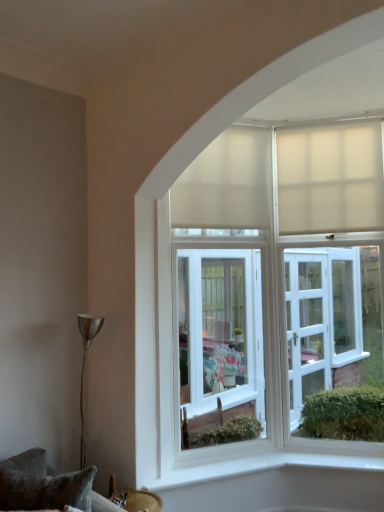
Question: Is velvet cushion at lower left outside beige matte curtain at upper right, the second curtain viewed from the left?

Choices:
 (A) yes
 (B) no

Answer: (A)

Question: Does velvet cushion at lower left turn towards beige matte curtain at upper right, which is the first curtain from right to left?

Choices:
 (A) no
 (B) yes

Answer: (A)

Question: Is velvet cushion at lower left wider than beige matte curtain at upper right, which is the first curtain from right to left?

Choices:
 (A) no
 (B) yes

Answer: (B)

Question: Are velvet cushion at lower left and beige matte curtain at upper right, which is the first curtain from right to left, located far from each other?

Choices:
 (A) yes
 (B) no

Answer: (A)

Question: Can you confirm if velvet cushion at lower left is positioned to the right of beige matte curtain at upper right, the second curtain viewed from the left?

Choices:
 (A) no
 (B) yes

Answer: (A)

Question: From a real-world perspective, is velvet cushion at lower left above or below white matte curtain at upper center, which is the 2th curtain in right-to-left order?

Choices:
 (A) below
 (B) above

Answer: (A)

Question: Considering the positions of velvet cushion at lower left and white matte curtain at upper center, which is the 2th curtain in right-to-left order, in the image, is velvet cushion at lower left wider or thinner than white matte curtain at upper center, which is the 2th curtain in right-to-left order,?

Choices:
 (A) thin
 (B) wide

Answer: (B)

Question: From the image's perspective, is velvet cushion at lower left positioned above or below white matte curtain at upper center, which is the 2th curtain in right-to-left order?

Choices:
 (A) above
 (B) below

Answer: (B)

Question: Based on their positions, is velvet cushion at lower left located to the left or right of white matte curtain at upper center, which is the 2th curtain in right-to-left order?

Choices:
 (A) right
 (B) left

Answer: (B)

Question: Considering the positions of white matte curtain at upper center, which is the first curtain from left to right, and velvet cushion at lower left in the image, is white matte curtain at upper center, which is the first curtain from left to right, taller or shorter than velvet cushion at lower left?

Choices:
 (A) short
 (B) tall

Answer: (B)

Question: In terms of size, does white matte curtain at upper center, which is the first curtain from left to right, appear bigger or smaller than velvet cushion at lower left?

Choices:
 (A) big
 (B) small

Answer: (A)

Question: Considering the positions of white matte curtain at upper center, which is the first curtain from left to right, and velvet cushion at lower left in the image, is white matte curtain at upper center, which is the first curtain from left to right, wider or thinner than velvet cushion at lower left?

Choices:
 (A) wide
 (B) thin

Answer: (B)

Question: From a real-world perspective, is white matte curtain at upper center, which is the first curtain from left to right, positioned above or below velvet cushion at lower left?

Choices:
 (A) above
 (B) below

Answer: (A)

Question: Do you think beige matte curtain at upper right, the second curtain viewed from the left, is within white matte curtain at upper center, which is the first curtain from left to right, or outside of it?

Choices:
 (A) outside
 (B) inside

Answer: (A)

Question: Is point [x=317, y=155] positioned closer to the camera than point [x=172, y=211]?

Choices:
 (A) closer
 (B) farther

Answer: (B)